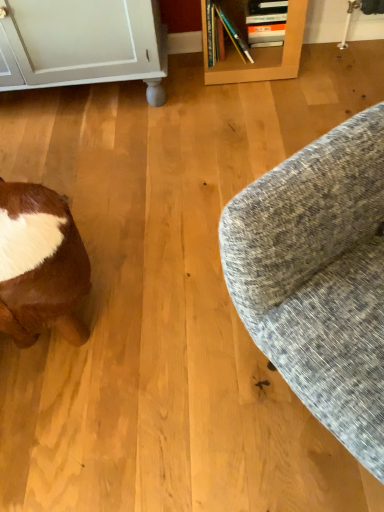
What is the approximate width of brown fur at lower left?

The width of brown fur at lower left is 13.40 inches.

Locate an element on the screen. This screenshot has height=512, width=384. brown fur at lower left is located at coordinates (40, 265).

What do you see at coordinates (40, 265) in the screenshot? I see `brown fur at lower left` at bounding box center [40, 265].

Measure the distance between point (293, 389) and camera.

The depth of point (293, 389) is 31.69 inches.

What do you see at coordinates (319, 277) in the screenshot?
I see `textured gray fabric couch at right` at bounding box center [319, 277].

I want to click on textured gray fabric couch at right, so click(319, 277).

In order to click on brown fur at lower left in this screenshot , I will do [x=40, y=265].

Considering the relative positions of brown fur at lower left and textured gray fabric couch at right in the image provided, is brown fur at lower left to the left or to the right of textured gray fabric couch at right?

Clearly, brown fur at lower left is on the left of textured gray fabric couch at right in the image.

Is brown fur at lower left in front of or behind textured gray fabric couch at right in the image?

brown fur at lower left is behind textured gray fabric couch at right.

Between point (5, 285) and point (337, 207), which one is positioned behind?

The point (5, 285) is more distant.

From the image's perspective, is brown fur at lower left above textured gray fabric couch at right?

Actually, brown fur at lower left appears below textured gray fabric couch at right in the image.

From a real-world perspective, between brown fur at lower left and textured gray fabric couch at right, who is vertically lower?

In real-world perspective, brown fur at lower left is lower.

Considering the sizes of brown fur at lower left and textured gray fabric couch at right in the image, is brown fur at lower left wider or thinner than textured gray fabric couch at right?

In the image, brown fur at lower left appears to be more narrow than textured gray fabric couch at right.

Which of these two, brown fur at lower left or textured gray fabric couch at right, stands taller?

textured gray fabric couch at right is taller.

Considering the sizes of objects brown fur at lower left and textured gray fabric couch at right in the image provided, who is bigger, brown fur at lower left or textured gray fabric couch at right?

textured gray fabric couch at right is bigger.

Is textured gray fabric couch at right surrounded by brown fur at lower left?

No.

Does brown fur at lower left touch textured gray fabric couch at right?

No, brown fur at lower left is not making contact with textured gray fabric couch at right.

Is brown fur at lower left aimed at textured gray fabric couch at right?

Yes, brown fur at lower left is aimed at textured gray fabric couch at right.

What's the angular difference between brown fur at lower left and textured gray fabric couch at right's facing directions?

141 degrees.

Where is `studio couch above the brown fur at lower left (from a real-world perspective)`? studio couch above the brown fur at lower left (from a real-world perspective) is located at coordinates (319, 277).

Which object is positioned more to the right, textured gray fabric couch at right or brown fur at lower left?

From the viewer's perspective, textured gray fabric couch at right appears more on the right side.

Which object is closer to the camera taking this photo, textured gray fabric couch at right or brown fur at lower left?

textured gray fabric couch at right is more forward.

Which is closer to the camera, (266, 287) or (58, 290)?

Point (266, 287) is positioned closer to the camera compared to point (58, 290).

From the image's perspective, between textured gray fabric couch at right and brown fur at lower left, who is located below?

brown fur at lower left appears lower in the image.

From a real-world perspective, is textured gray fabric couch at right above or below brown fur at lower left?

Clearly, from a real-world perspective, textured gray fabric couch at right is above brown fur at lower left.

Can you confirm if textured gray fabric couch at right is thinner than brown fur at lower left?

No, textured gray fabric couch at right is not thinner than brown fur at lower left.

Is textured gray fabric couch at right taller or shorter than brown fur at lower left?

Considering their sizes, textured gray fabric couch at right has more height than brown fur at lower left.

Can you confirm if textured gray fabric couch at right is bigger than brown fur at lower left?

Yes, textured gray fabric couch at right is bigger than brown fur at lower left.

Is brown fur at lower left located within textured gray fabric couch at right?

Actually, brown fur at lower left is outside textured gray fabric couch at right.

Is textured gray fabric couch at right beside brown fur at lower left?

No, textured gray fabric couch at right is not with brown fur at lower left.

Is brown fur at lower left at the back of textured gray fabric couch at right?

No, textured gray fabric couch at right is not facing away from brown fur at lower left.

How different are the orientations of textured gray fabric couch at right and brown fur at lower left in degrees?

textured gray fabric couch at right and brown fur at lower left are facing 141 degrees away from each other.

Identify the location of animal below the textured gray fabric couch at right (from the image's perspective). (40, 265).

You are a GUI agent. You are given a task and a screenshot of the screen. Output one action in this format:
    pyautogui.click(x=<x>, y=<y>)
    Task: Click on the studio couch that is in front of the brown fur at lower left
    The width and height of the screenshot is (384, 512).
    Given the screenshot: What is the action you would take?
    pyautogui.click(x=319, y=277)

Where is `animal below the textured gray fabric couch at right (from the image's perspective)`? Image resolution: width=384 pixels, height=512 pixels. animal below the textured gray fabric couch at right (from the image's perspective) is located at coordinates (40, 265).